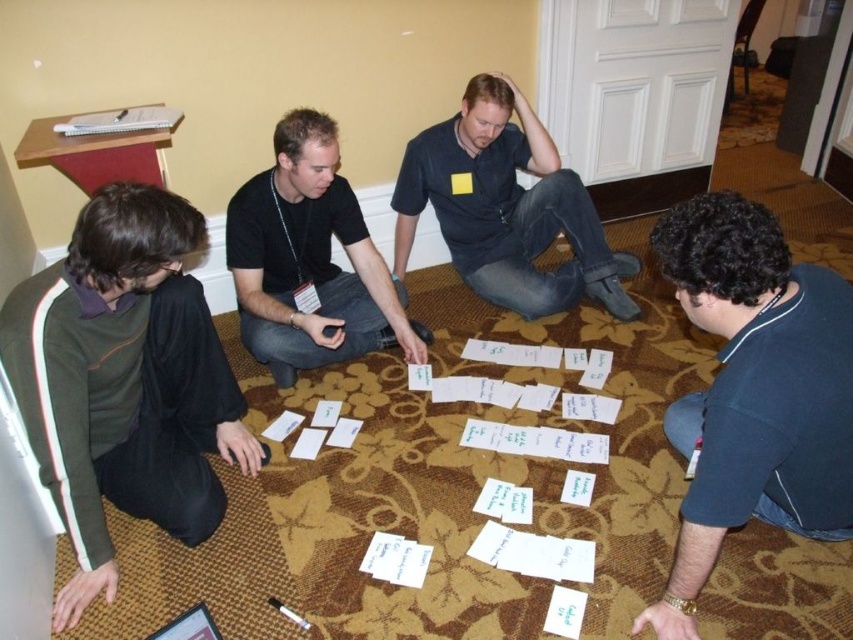
Question: Can you confirm if white paper at center is positioned above dark blue shirt at lower right?

Choices:
 (A) yes
 (B) no

Answer: (B)

Question: Is green fabric shirt at lower left thinner than dark blue shirt at lower right?

Choices:
 (A) yes
 (B) no

Answer: (A)

Question: Which object appears farthest from the camera in this image?

Choices:
 (A) black cotton shirt at center
 (B) dark blue shirt at lower right
 (C) white paper at center
 (D) green fabric shirt at lower left

Answer: (A)

Question: Can you confirm if green fabric shirt at lower left is smaller than white paper at center?

Choices:
 (A) no
 (B) yes

Answer: (B)

Question: Which of the following is the closest to the observer?

Choices:
 (A) (454, 221)
 (B) (531, 609)

Answer: (B)

Question: Which point is closer to the camera taking this photo?

Choices:
 (A) (67, 273)
 (B) (584, 276)
 (C) (753, 317)

Answer: (C)